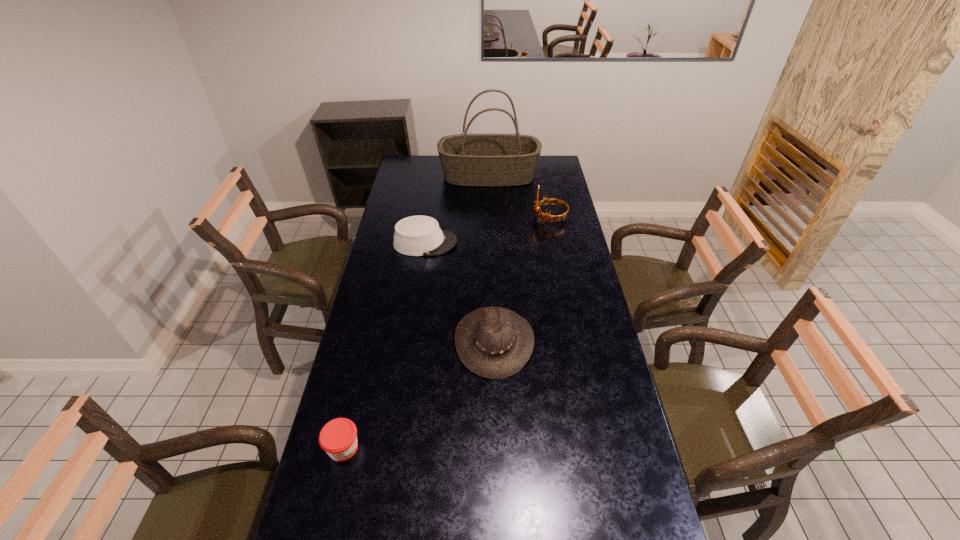
The height and width of the screenshot is (540, 960). I want to click on hat positioned at the left edge, so click(419, 235).

Find the location of a particular element. jam that is at the left edge is located at coordinates [x=338, y=438].

Identify the location of basket that is at the right edge. The image size is (960, 540). (485, 160).

Where is `tiara that is at the right edge`? The height and width of the screenshot is (540, 960). tiara that is at the right edge is located at coordinates (550, 201).

In order to click on object at the far right corner in this screenshot , I will do `click(485, 160)`.

The image size is (960, 540). Find the location of `vacant position at the left edge of the desktop`. vacant position at the left edge of the desktop is located at coordinates point(322,464).

Locate an element on the screen. vacant area at the right edge of the desktop is located at coordinates (564, 197).

Identify the location of blank region between the tallest object and the nearer hat. [x=492, y=259].

You are a GUI agent. You are given a task and a screenshot of the screen. Output one action in this format:
    pyautogui.click(x=<x>, y=<y>)
    Task: Click on the free spot between the left hat and the nearest object
    
    Given the screenshot: What is the action you would take?
    pyautogui.click(x=384, y=346)

You are a GUI agent. You are given a task and a screenshot of the screen. Output one action in this format:
    pyautogui.click(x=<x>, y=<y>)
    Task: Click on the free space between the basket and the nearer hat
    The image size is (960, 540).
    Given the screenshot: What is the action you would take?
    pyautogui.click(x=492, y=259)